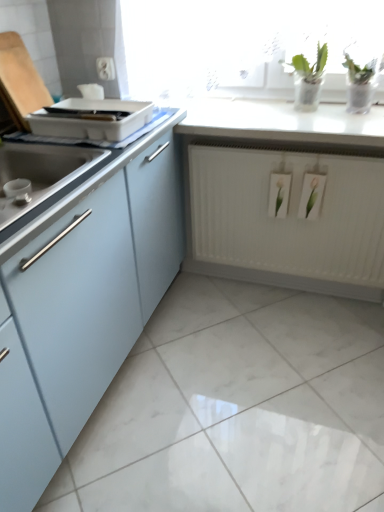
Question: Considering the relative sizes of white glossy countertop at upper center and white plastic tray at upper left in the image provided, is white glossy countertop at upper center bigger than white plastic tray at upper left?

Choices:
 (A) no
 (B) yes

Answer: (B)

Question: Considering the relative sizes of white glossy countertop at upper center and white plastic tray at upper left in the image provided, is white glossy countertop at upper center shorter than white plastic tray at upper left?

Choices:
 (A) yes
 (B) no

Answer: (A)

Question: From a real-world perspective, is white glossy countertop at upper center on top of white plastic tray at upper left?

Choices:
 (A) yes
 (B) no

Answer: (B)

Question: Is white glossy countertop at upper center to the right of white plastic tray at upper left from the viewer's perspective?

Choices:
 (A) no
 (B) yes

Answer: (B)

Question: From the image's perspective, is white glossy countertop at upper center located beneath white plastic tray at upper left?

Choices:
 (A) no
 (B) yes

Answer: (A)

Question: Is white glossy countertop at upper center not within white plastic tray at upper left?

Choices:
 (A) no
 (B) yes

Answer: (B)

Question: Is white plastic electric outlet at upper center located within matte light blue cabinet at left?

Choices:
 (A) yes
 (B) no

Answer: (B)

Question: Is matte light blue cabinet at left bigger than white plastic electric outlet at upper center?

Choices:
 (A) yes
 (B) no

Answer: (A)

Question: Can we say matte light blue cabinet at left lies outside white plastic electric outlet at upper center?

Choices:
 (A) no
 (B) yes

Answer: (B)

Question: From a real-world perspective, is matte light blue cabinet at left located beneath white plastic electric outlet at upper center?

Choices:
 (A) no
 (B) yes

Answer: (B)

Question: Considering the relative sizes of matte light blue cabinet at left and white plastic electric outlet at upper center in the image provided, is matte light blue cabinet at left shorter than white plastic electric outlet at upper center?

Choices:
 (A) no
 (B) yes

Answer: (A)

Question: Is matte light blue cabinet at left with white plastic electric outlet at upper center?

Choices:
 (A) no
 (B) yes

Answer: (A)

Question: Does matte light blue cabinet at left turn towards white plastic tray at upper left?

Choices:
 (A) yes
 (B) no

Answer: (B)